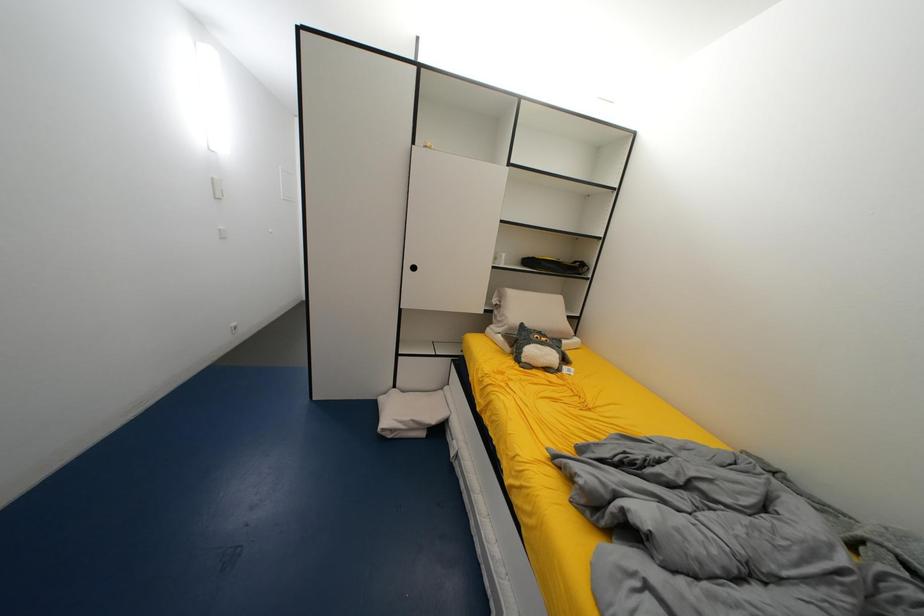
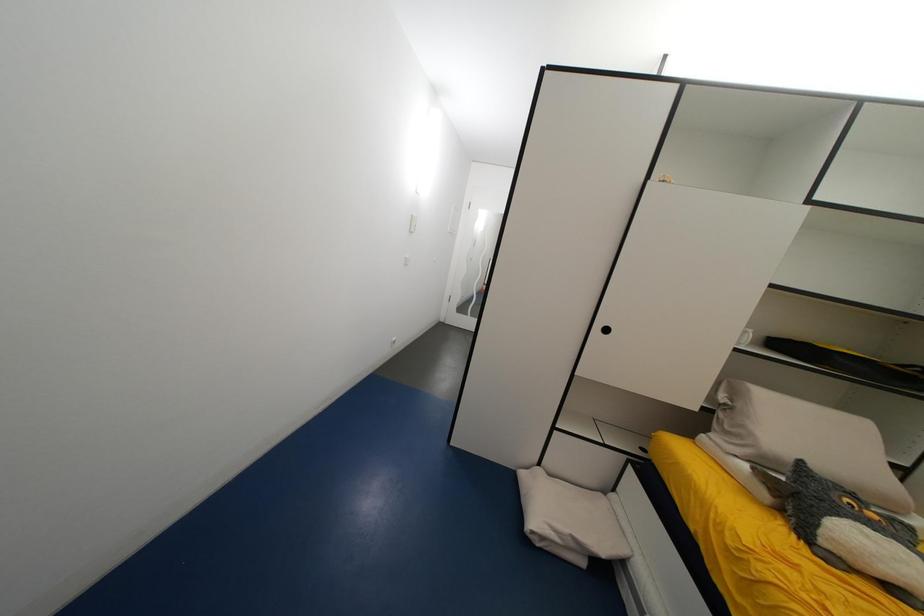
Question: How did the camera likely rotate?

Choices:
 (A) Left
 (B) Right
 (C) Up
 (D) Down

Answer: (A)